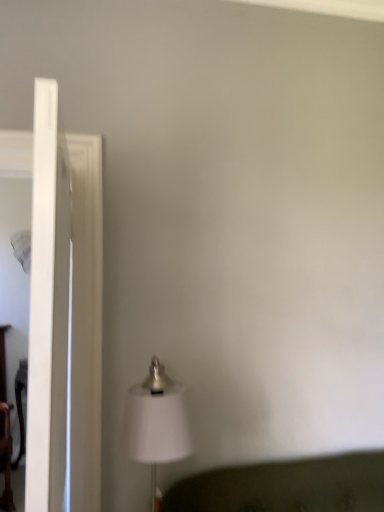
Locate an element on the screen. Image resolution: width=384 pixels, height=512 pixels. clear glass door at left is located at coordinates (48, 307).

The height and width of the screenshot is (512, 384). Describe the element at coordinates (48, 307) in the screenshot. I see `clear glass door at left` at that location.

The height and width of the screenshot is (512, 384). What do you see at coordinates (157, 422) in the screenshot?
I see `white fabric lampshade at lower center` at bounding box center [157, 422].

Where is `white fabric lampshade at lower center`? The height and width of the screenshot is (512, 384). white fabric lampshade at lower center is located at coordinates (157, 422).

Locate an element on the screen. Image resolution: width=384 pixels, height=512 pixels. clear glass door at left is located at coordinates (48, 307).

Does clear glass door at left appear on the left side of white fabric lampshade at lower center?

Indeed, clear glass door at left is positioned on the left side of white fabric lampshade at lower center.

Considering the relative positions of clear glass door at left and white fabric lampshade at lower center in the image provided, is clear glass door at left in front of white fabric lampshade at lower center?

Yes, clear glass door at left is in front of white fabric lampshade at lower center.

Does point (58, 178) appear closer or farther from the camera than point (184, 436)?

Clearly, point (58, 178) is closer to the camera than point (184, 436).

Consider the image. From the image's perspective, which one is positioned higher, clear glass door at left or white fabric lampshade at lower center?

From the image's view, clear glass door at left is above.

From a real-world perspective, is clear glass door at left below white fabric lampshade at lower center?

Incorrect, from a real-world perspective, clear glass door at left is higher than white fabric lampshade at lower center.

Can you confirm if clear glass door at left is wider than white fabric lampshade at lower center?

Incorrect, the width of clear glass door at left does not surpass that of white fabric lampshade at lower center.

Consider the image. Does clear glass door at left have a greater height compared to white fabric lampshade at lower center?

Yes.

Which of these two, clear glass door at left or white fabric lampshade at lower center, is bigger?

clear glass door at left is bigger.

Is clear glass door at left located outside white fabric lampshade at lower center?

Yes, clear glass door at left is located beyond the bounds of white fabric lampshade at lower center.

Is clear glass door at left beside white fabric lampshade at lower center?

No, clear glass door at left is not next to white fabric lampshade at lower center.

Looking at this image, could you tell me if clear glass door at left is turned towards white fabric lampshade at lower center?

Yes.

How many degrees apart are the facing directions of clear glass door at left and white fabric lampshade at lower center?

The facing directions of clear glass door at left and white fabric lampshade at lower center are 83.7 degrees apart.

This screenshot has height=512, width=384. In order to click on lamp directly beneath the clear glass door at left (from a real-world perspective) in this screenshot , I will do `click(157, 422)`.

Is white fabric lampshade at lower center to the left or to the right of clear glass door at left in the image?

In the image, white fabric lampshade at lower center appears on the right side of clear glass door at left.

Between white fabric lampshade at lower center and clear glass door at left, which one is positioned behind?

white fabric lampshade at lower center.

Which is in front, point (145, 459) or point (38, 454)?

The point (38, 454) is closer to the camera.

From the image's perspective, is white fabric lampshade at lower center located beneath clear glass door at left?

Yes, from the image's perspective, white fabric lampshade at lower center is beneath clear glass door at left.

From a real-world perspective, is white fabric lampshade at lower center on clear glass door at left?

No, from a real-world perspective, white fabric lampshade at lower center is not above clear glass door at left.

Between white fabric lampshade at lower center and clear glass door at left, which one has larger width?

With larger width is white fabric lampshade at lower center.

Which of these two, white fabric lampshade at lower center or clear glass door at left, stands shorter?

With less height is white fabric lampshade at lower center.

Based on their sizes in the image, would you say white fabric lampshade at lower center is bigger or smaller than clear glass door at left?

white fabric lampshade at lower center is smaller than clear glass door at left.

Is white fabric lampshade at lower center spatially inside clear glass door at left, or outside of it?

The correct answer is: outside.

Is white fabric lampshade at lower center placed right next to clear glass door at left?

No, white fabric lampshade at lower center is not making contact with clear glass door at left.

Is white fabric lampshade at lower center turned away from clear glass door at left?

No, white fabric lampshade at lower center is not facing the opposite direction of clear glass door at left.

Can you tell me how much white fabric lampshade at lower center and clear glass door at left differ in facing direction?

There is a 83.7-degree angle between the facing directions of white fabric lampshade at lower center and clear glass door at left.

How much distance is there between white fabric lampshade at lower center and clear glass door at left?

A distance of 34.07 centimeters exists between white fabric lampshade at lower center and clear glass door at left.

There is a white fabric lampshade at lower center. Identify the location of glass door above it (from a real-world perspective). (48, 307).

Find the location of a particular element. lamp located underneath the clear glass door at left (from a real-world perspective) is located at coordinates (157, 422).

You are a GUI agent. You are given a task and a screenshot of the screen. Output one action in this format:
    pyautogui.click(x=<x>, y=<y>)
    Task: Click on the glass door lying on the left of white fabric lampshade at lower center
    This screenshot has height=512, width=384.
    Given the screenshot: What is the action you would take?
    pyautogui.click(x=48, y=307)